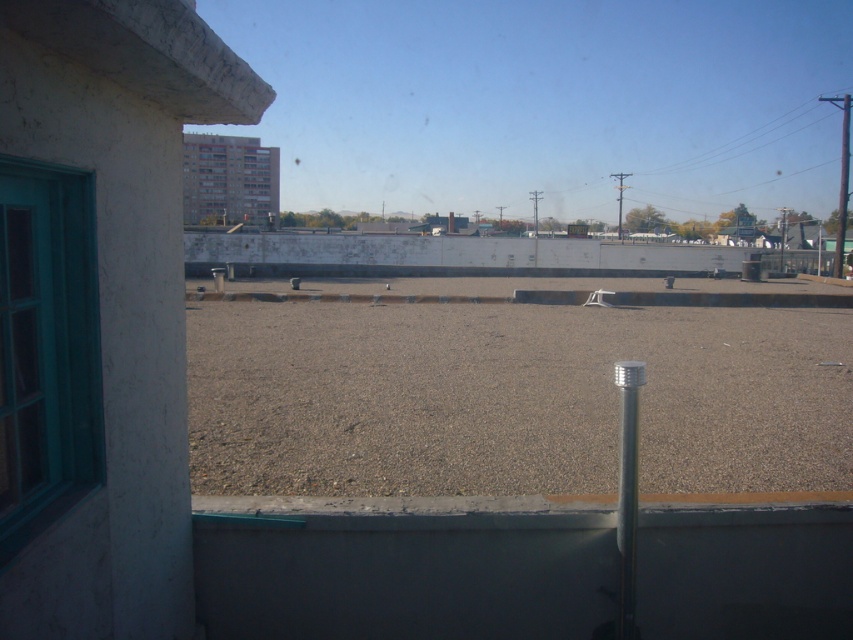
In the scene shown: You are an architect designing a new rooftop garden. You need to place a 1.5 meter tall sculpture exactly where the brown gravel at center is located. Given the coordinates provided, will the sculpture fit within the visible rooftop area shown in the image?

The brown gravel at center is located at coordinates point (512, 397). Since the sculpture is 1.5 meters tall, its height will not affect its placement on the rooftop area as the coordinates indicate a position, not a dimension. The sculpture can be placed there as long as the rooftop area at that point has sufficient space. However, the description does not provide information about the rooftop area dimensions, so we cannot confirm if it fits based on the given data.

You are a window cleaner standing on the rooftop. You need to clean the teal glass window at left but there is brown gravel at center in your way. Can you walk around the gravel to reach the window without stepping on it?

The brown gravel at center and teal glass window at left are 6.01 meters apart, so you can walk around the gravel at center to reach the teal glass window at left without stepping on it since there is enough space between them.

You are an architect designing a new rooftop garden. You observe the brown gravel at center and the matte glass window at upper center. Which object is lower in height from the ground level?

The brown gravel at center has a lesser height compared to the matte glass window at upper center, so the brown gravel at center is lower in height from the ground level.